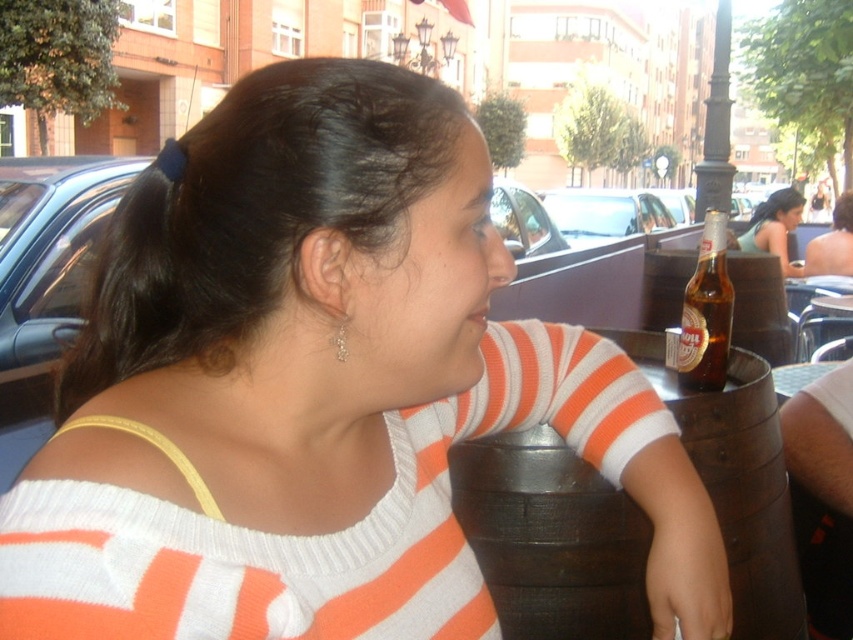
You are a photographer standing at the camera position. You want to take a photo of the brown wooden barrel at lower right. Can you reach it without moving your feet?

The brown wooden barrel at lower right and camera are 1.05 meters apart, so you can reach it without moving your feet since the distance is within arm reach.

You are a delivery person who needs to place a package at the exact location of the point marked at coordinates point (x=775, y=227). The package is 10 cm in width. The table where you need to place it is 40 cm wide. Can you fit the package there?

The point (x=775, y=227) corresponds to the matte black bottle at upper right. Since the package is 10 cm wide and the table is 40 cm wide, there is enough space to place the package next to the matte black bottle at upper right as long as other items do not occupy the space.